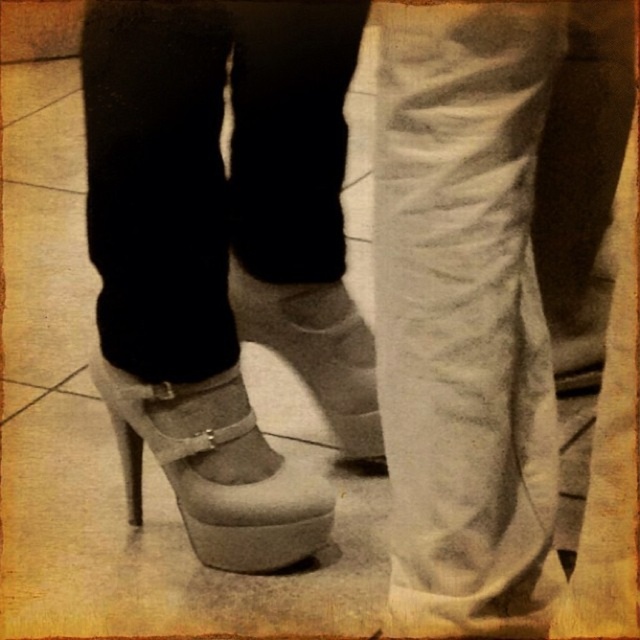
Question: Does matte gray sandal at center appear on the left side of white suede shoe at center?

Choices:
 (A) yes
 (B) no

Answer: (A)

Question: Is matte gray sandal at center below white suede shoe at center?

Choices:
 (A) yes
 (B) no

Answer: (A)

Question: Among these points, which one is nearest to the camera?

Choices:
 (A) (284, 326)
 (B) (170, 470)

Answer: (B)

Question: Can you confirm if matte gray sandal at center is positioned to the left of white suede shoe at center?

Choices:
 (A) no
 (B) yes

Answer: (B)